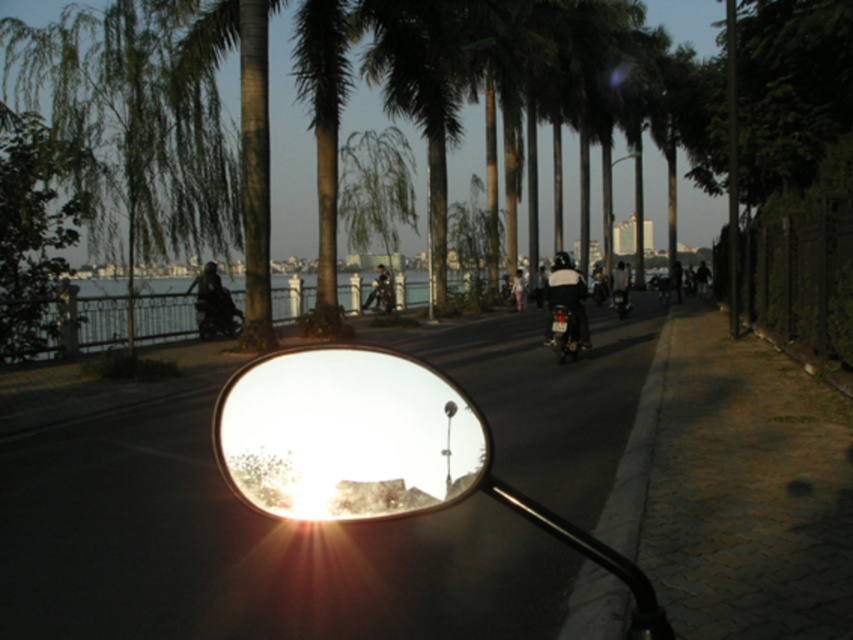
Question: Which point is closer to the camera taking this photo?

Choices:
 (A) (213, 330)
 (B) (254, 378)

Answer: (B)

Question: Does green leafy tree at center appear on the left side of white matte helmet at center?

Choices:
 (A) no
 (B) yes

Answer: (B)

Question: Among these points, which one is nearest to the camera?

Choices:
 (A) (207, 262)
 (B) (187, 77)
 (C) (306, 8)

Answer: (B)

Question: Is green textured palm tree at upper left wider than black matte motorcycle at center?

Choices:
 (A) no
 (B) yes

Answer: (B)

Question: Does dark fabric jacket at left appear on the left side of shiny black motorcycle at left?

Choices:
 (A) yes
 (B) no

Answer: (A)

Question: Which of the following is the farthest from the observer?

Choices:
 (A) black matte motorcycle at center
 (B) glossy metallic mirror at center
 (C) green leafy palm tree at center

Answer: (C)